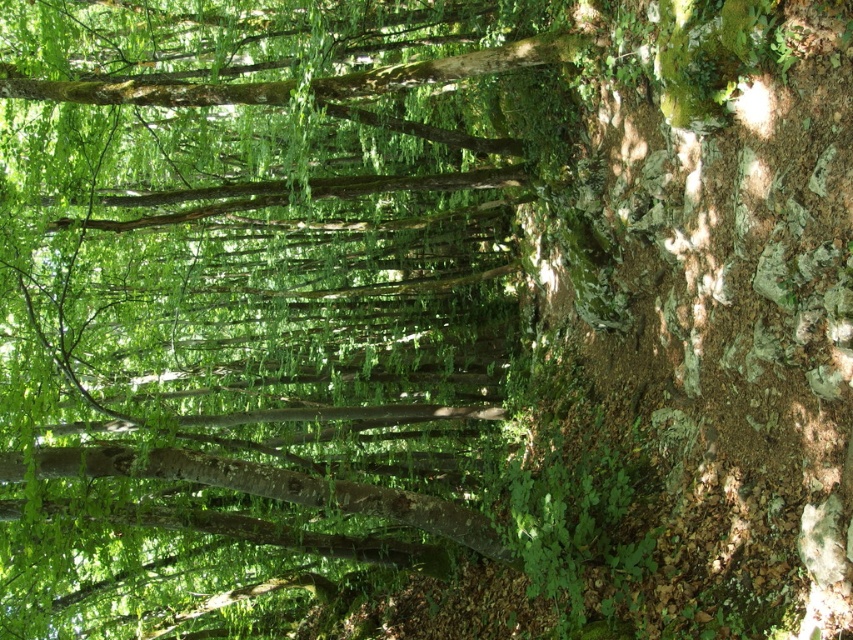
Between point (283, 561) and point (252, 493), which one is positioned behind?

Positioned behind is point (283, 561).

Does green leafy tree at center have a larger size compared to smooth brown tree trunk at center?

Yes.

Describe the element at coordinates (254, 300) in the screenshot. This screenshot has height=640, width=853. I see `green leafy tree at center` at that location.

At what (x,y) coordinates should I click in order to perform the action: click on green leafy tree at center. Please return your answer as a coordinate pair (x, y). The image size is (853, 640). Looking at the image, I should click on (254, 300).